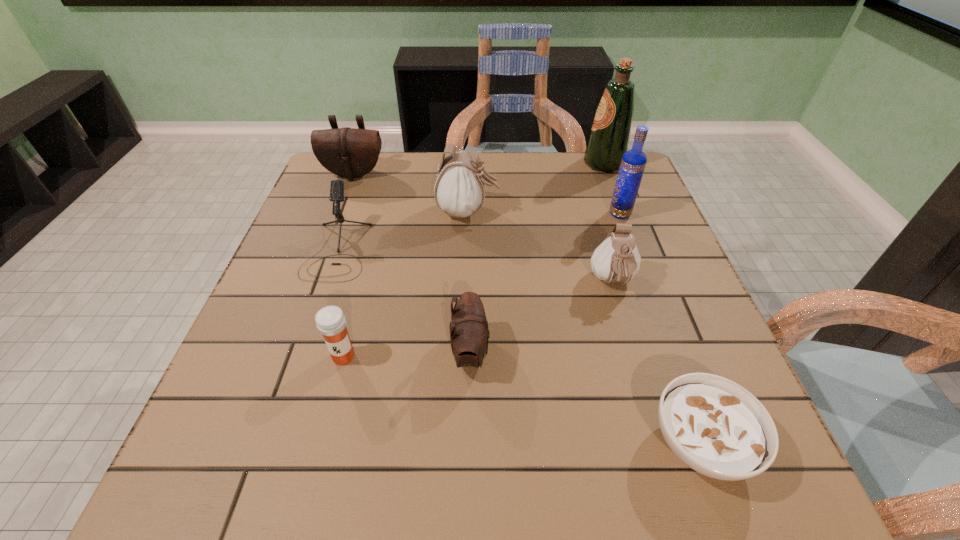
Identify the location of free space at the left edge of the desktop. (269, 322).

Where is `free space at the right edge of the desktop`? This screenshot has width=960, height=540. free space at the right edge of the desktop is located at coordinates (667, 233).

Image resolution: width=960 pixels, height=540 pixels. In the image, there is a desktop. Identify the location of vacant space at the far left corner. (334, 178).

Image resolution: width=960 pixels, height=540 pixels. In the image, there is a desktop. In order to click on blank space at the near left corner in this screenshot , I will do `click(204, 467)`.

In the image, there is a desktop. At what (x,y) coordinates should I click in order to perform the action: click on vacant space at the far right corner. Please return your answer as a coordinate pair (x, y). Looking at the image, I should click on (612, 179).

In the image, there is a desktop. At what (x,y) coordinates should I click in order to perform the action: click on vacant space at the near right corner. Please return your answer as a coordinate pair (x, y). The width and height of the screenshot is (960, 540). Looking at the image, I should click on (793, 496).

Where is `free space between the medicine and the right brown pouch`? This screenshot has height=540, width=960. free space between the medicine and the right brown pouch is located at coordinates (407, 354).

Locate an element on the screen. free space that is in between the eighth shortest object and the farthest pouch is located at coordinates (487, 194).

This screenshot has height=540, width=960. In order to click on free spot between the right brown pouch and the olive oil in this screenshot , I will do `click(538, 258)`.

You are a GUI agent. You are given a task and a screenshot of the screen. Output one action in this format:
    pyautogui.click(x=<x>, y=<y>)
    Task: Click on the unoccupied position between the left brown pouch and the bigger white pouch
    This screenshot has width=960, height=540.
    Given the screenshot: What is the action you would take?
    pyautogui.click(x=411, y=193)